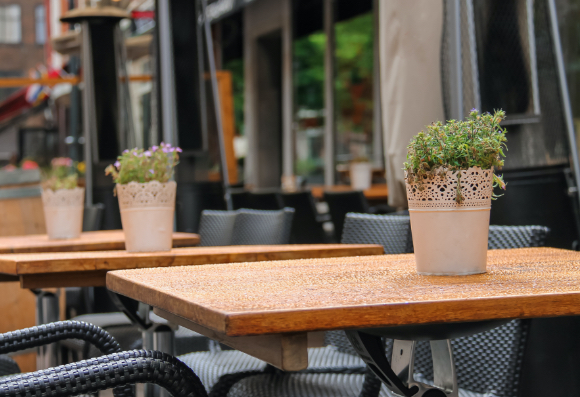
Locate an element on the screen. table centerpiece is located at coordinates (450, 159), (145, 149), (141, 208), (54, 173), (451, 222).